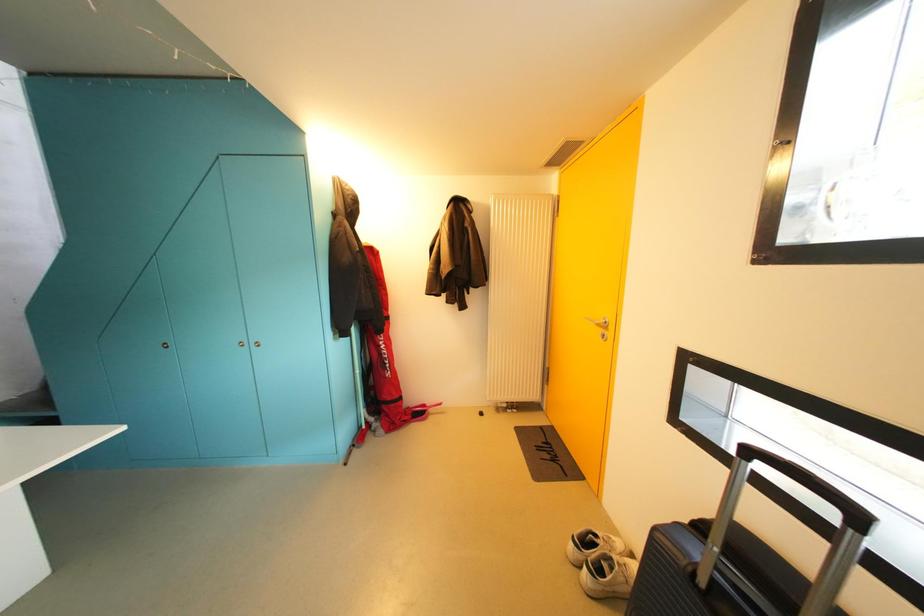
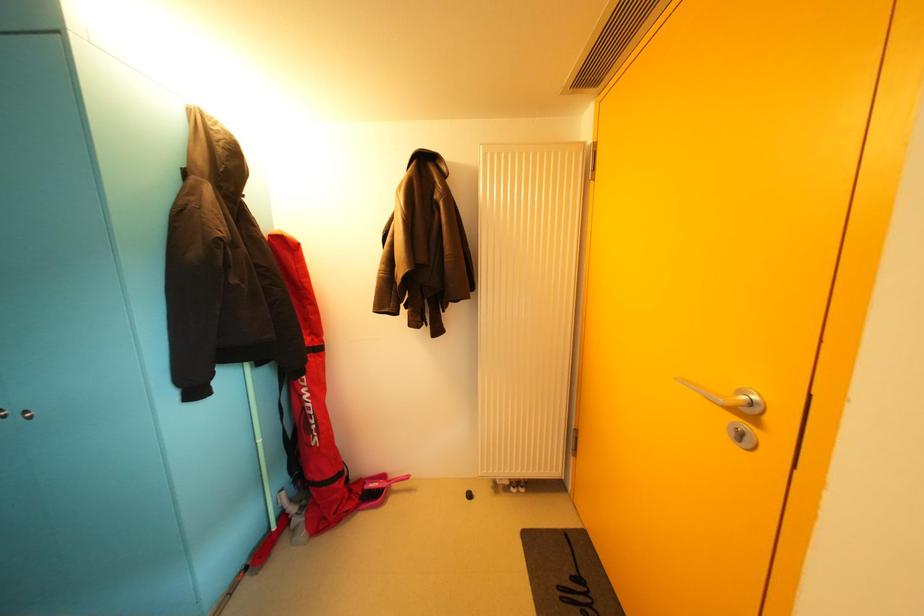
Question: Which direction would the cameraman need to move to produce the second image? Reply with the corresponding letter.

Choices:
 (A) Left
 (B) Right
 (C) Forward
 (D) Backward

Answer: (C)